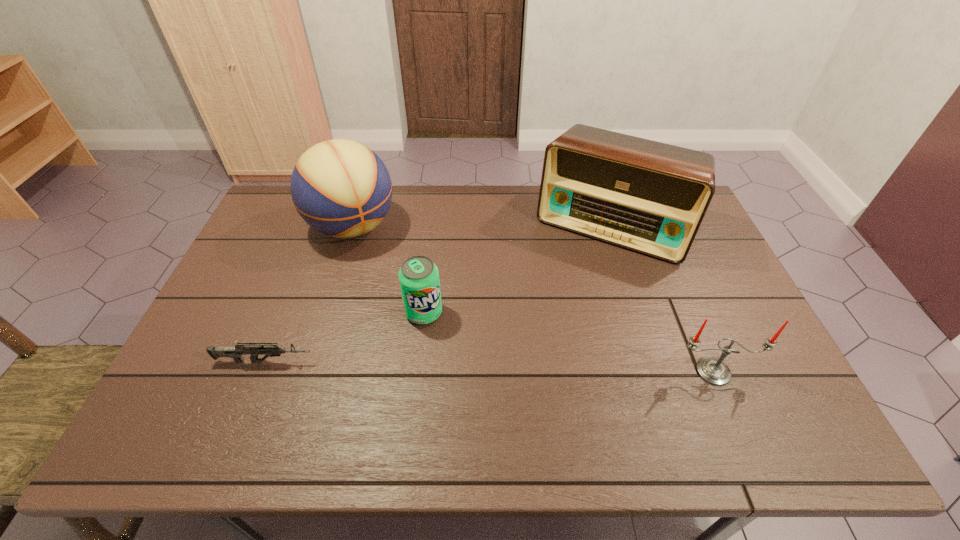
In order to click on empty location between the basketball and the candle in this screenshot , I will do `click(533, 299)`.

You are a GUI agent. You are given a task and a screenshot of the screen. Output one action in this format:
    pyautogui.click(x=<x>, y=<y>)
    Task: Click on the unoccupied area between the gun and the candle
    The height and width of the screenshot is (540, 960).
    Given the screenshot: What is the action you would take?
    pyautogui.click(x=490, y=366)

Identify which object is located as the nearest to the candle. Please provide its 2D coordinates. Your answer should be formatted as a tuple, i.e. [(x, y)], where the tuple contains the x and y coordinates of a point satisfying the conditions above.

[(650, 197)]

Locate an element on the screen. The width and height of the screenshot is (960, 540). object that is the third closest one to the radio receiver is located at coordinates tap(341, 188).

At what (x,y) coordinates should I click in order to perform the action: click on vacant region that satisfies the following two spatial constraints: 1. on the front side of the second shortest object; 2. on the left side of the basketball. Please return your answer as a coordinate pair (x, y). Looking at the image, I should click on (326, 313).